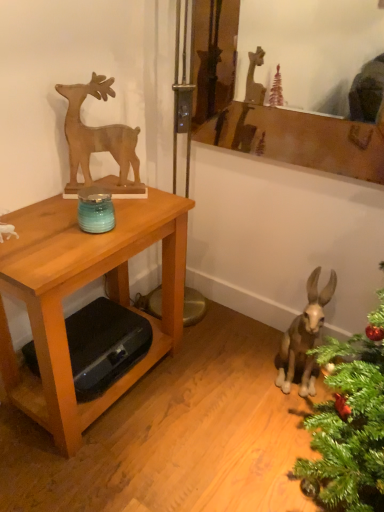
You are a GUI agent. You are given a task and a screenshot of the screen. Output one action in this format:
    pyautogui.click(x=<x>, y=<y>)
    Task: Click on the free point above wooden table at left (from a real-world perspective)
    This screenshot has height=512, width=384.
    Given the screenshot: What is the action you would take?
    tap(76, 221)